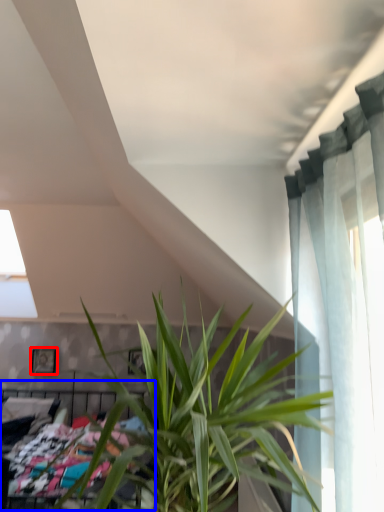
Question: Which of the following is the farthest to the observer, picture frame (highlighted by a red box) or bed (highlighted by a blue box)?

Choices:
 (A) picture frame
 (B) bed

Answer: (A)